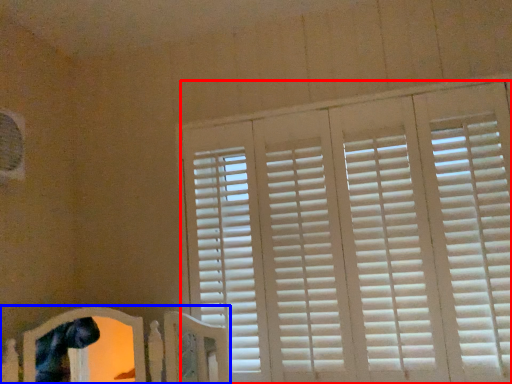
Question: Which object is closer to the camera taking this photo, window blind (highlighted by a red box) or bed frame (highlighted by a blue box)?

Choices:
 (A) window blind
 (B) bed frame

Answer: (B)